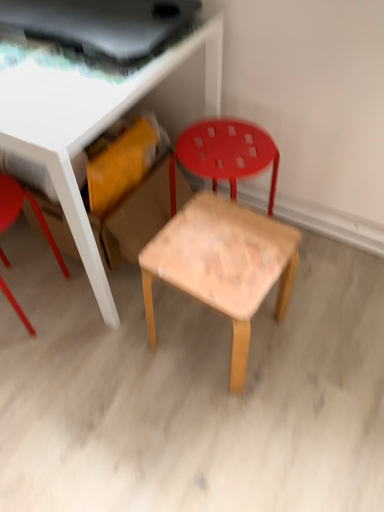
Where is `free spot above natural wood stool at center (from a real-world perspective)`? free spot above natural wood stool at center (from a real-world perspective) is located at coordinates (212, 250).